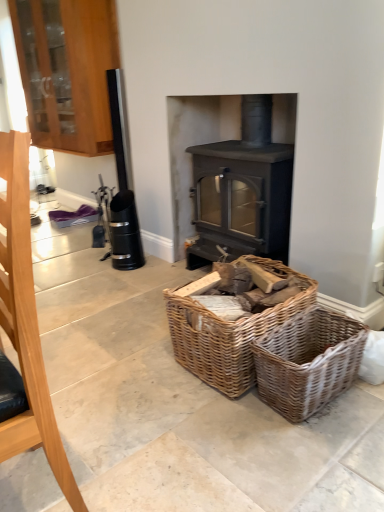
The height and width of the screenshot is (512, 384). What do you see at coordinates (229, 333) in the screenshot? I see `woven wood basket at center` at bounding box center [229, 333].

Image resolution: width=384 pixels, height=512 pixels. Find the location of `wooden cabinet at upper left`. wooden cabinet at upper left is located at coordinates (67, 71).

Measure the distance between woven brown basket at lower center and camera.

woven brown basket at lower center is 1.47 meters away from camera.

This screenshot has width=384, height=512. What do you see at coordinates (243, 190) in the screenshot? I see `matte gray wood burning stove at center` at bounding box center [243, 190].

The image size is (384, 512). I want to click on woven wood basket at center, so click(229, 333).

Does point (74, 6) come behind point (11, 175)?

Yes, it is.

Can you confirm if wooden cabinet at upper left is taller than brushed metal fireplace tool at left?

Yes.

Can we say wooden cabinet at upper left lies outside brushed metal fireplace tool at left?

wooden cabinet at upper left lies outside brushed metal fireplace tool at left's area.

Is wooden cabinet at upper left looking in the opposite direction of brushed metal fireplace tool at left?

wooden cabinet at upper left does not have its back to brushed metal fireplace tool at left.

Can you confirm if brushed metal fireplace tool at left is smaller than woven brown basket at lower center?

Incorrect, brushed metal fireplace tool at left is not smaller in size than woven brown basket at lower center.

Is brushed metal fireplace tool at left far from woven brown basket at lower center?

They are positioned close to each other.

Which is more to the right, brushed metal fireplace tool at left or woven brown basket at lower center?

woven brown basket at lower center.

Is brushed metal fireplace tool at left looking in the opposite direction of woven brown basket at lower center?

That's right, brushed metal fireplace tool at left is facing away from woven brown basket at lower center.

Could you tell me if woven brown basket at lower center is facing wooden cabinet at upper left?

No, woven brown basket at lower center is not facing towards wooden cabinet at upper left.

Does woven brown basket at lower center have a greater width compared to wooden cabinet at upper left?

Indeed, woven brown basket at lower center has a greater width compared to wooden cabinet at upper left.

From the image's perspective, is woven brown basket at lower center located beneath wooden cabinet at upper left?

Yes, from the image's perspective, woven brown basket at lower center is beneath wooden cabinet at upper left.

Which of these two, woven wood basket at center or matte gray wood burning stove at center, stands taller?

matte gray wood burning stove at center.

Is woven wood basket at center situated inside matte gray wood burning stove at center or outside?

woven wood basket at center is located beyond the bounds of matte gray wood burning stove at center.

Are woven wood basket at center and matte gray wood burning stove at center beside each other?

No, woven wood basket at center is not touching matte gray wood burning stove at center.

Considering the relative positions of woven wood basket at center and matte gray wood burning stove at center in the image provided, is woven wood basket at center to the left or to the right of matte gray wood burning stove at center?

In the image, woven wood basket at center appears on the left side of matte gray wood burning stove at center.

Is point (9, 446) in front of point (265, 108)?

Yes.

From the picture: Could you measure the distance between brushed metal fireplace tool at left and matte gray wood burning stove at center?

The distance of brushed metal fireplace tool at left from matte gray wood burning stove at center is 1.64 meters.

Which is more to the right, brushed metal fireplace tool at left or matte gray wood burning stove at center?

matte gray wood burning stove at center is more to the right.

Is brushed metal fireplace tool at left bigger or smaller than matte gray wood burning stove at center?

Clearly, brushed metal fireplace tool at left is smaller in size than matte gray wood burning stove at center.

From the image's perspective, would you say wooden cabinet at upper left is shown under woven brown basket at lower center?

No, from the image's perspective, wooden cabinet at upper left is not below woven brown basket at lower center.

In the scene shown: Between wooden cabinet at upper left and woven brown basket at lower center, which one has larger width?

Wider between the two is woven brown basket at lower center.

Is wooden cabinet at upper left not close to woven brown basket at lower center?

Yes, wooden cabinet at upper left and woven brown basket at lower center are located far from each other.

You are a GUI agent. You are given a task and a screenshot of the screen. Output one action in this format:
    pyautogui.click(x=<x>, y=<y>)
    Task: Click on the cabinetry above the woven brown basket at lower center (from the image's perspective)
    The width and height of the screenshot is (384, 512).
    Given the screenshot: What is the action you would take?
    pyautogui.click(x=67, y=71)

In the image, is woven wood basket at center on the left side or the right side of wooden cabinet at upper left?

Clearly, woven wood basket at center is on the right of wooden cabinet at upper left in the image.

From the image's perspective, who appears lower, woven wood basket at center or wooden cabinet at upper left?

woven wood basket at center appears lower in the image.

In the scene shown: Between woven wood basket at center and wooden cabinet at upper left, which one has smaller size?

With smaller size is woven wood basket at center.

Identify the location of cabinetry that is above the brushed metal fireplace tool at left (from a real-world perspective). (67, 71).

What are the coordinates of `basket below the brushed metal fireplace tool at left (from a real-world perspective)` in the screenshot? It's located at (308, 361).

Based on the photo, from the image, which object appears to be farther from woven brown basket at lower center, brushed metal fireplace tool at left or woven wood basket at center?

brushed metal fireplace tool at left is positioned further to the anchor woven brown basket at lower center.

Looking at this image, when comparing their distances from brushed metal fireplace tool at left, does woven wood basket at center or wooden cabinet at upper left seem further?

Among the two, wooden cabinet at upper left is located further to brushed metal fireplace tool at left.

Considering their positions, is matte gray wood burning stove at center positioned further to woven brown basket at lower center than brushed metal fireplace tool at left?

Among the two, brushed metal fireplace tool at left is located further to woven brown basket at lower center.

From the image, which object appears to be nearer to woven wood basket at center, brushed metal fireplace tool at left or matte gray wood burning stove at center?

The object closer to woven wood basket at center is matte gray wood burning stove at center.

When comparing their distances from wooden cabinet at upper left, does matte gray wood burning stove at center or woven wood basket at center seem closer?

matte gray wood burning stove at center.

Looking at the image, which one is located closer to woven brown basket at lower center, woven wood basket at center or matte gray wood burning stove at center?

woven wood basket at center.

Based on their spatial positions, is woven wood basket at center or brushed metal fireplace tool at left further from matte gray wood burning stove at center?

brushed metal fireplace tool at left.

Estimate the real-world distances between objects in this image. Which object is further from brushed metal fireplace tool at left, wooden cabinet at upper left or matte gray wood burning stove at center?

wooden cabinet at upper left is further to brushed metal fireplace tool at left.

The height and width of the screenshot is (512, 384). Identify the location of basket positioned between brushed metal fireplace tool at left and matte gray wood burning stove at center from near to far. (308, 361).

The width and height of the screenshot is (384, 512). Identify the location of wood burning stove positioned between brushed metal fireplace tool at left and wooden cabinet at upper left from near to far. (243, 190).

Image resolution: width=384 pixels, height=512 pixels. I want to click on picnic basket between brushed metal fireplace tool at left and wooden cabinet at upper left along the z-axis, so click(229, 333).

Locate an element on the screen. picnic basket that lies between matte gray wood burning stove at center and woven brown basket at lower center from top to bottom is located at coordinates (229, 333).